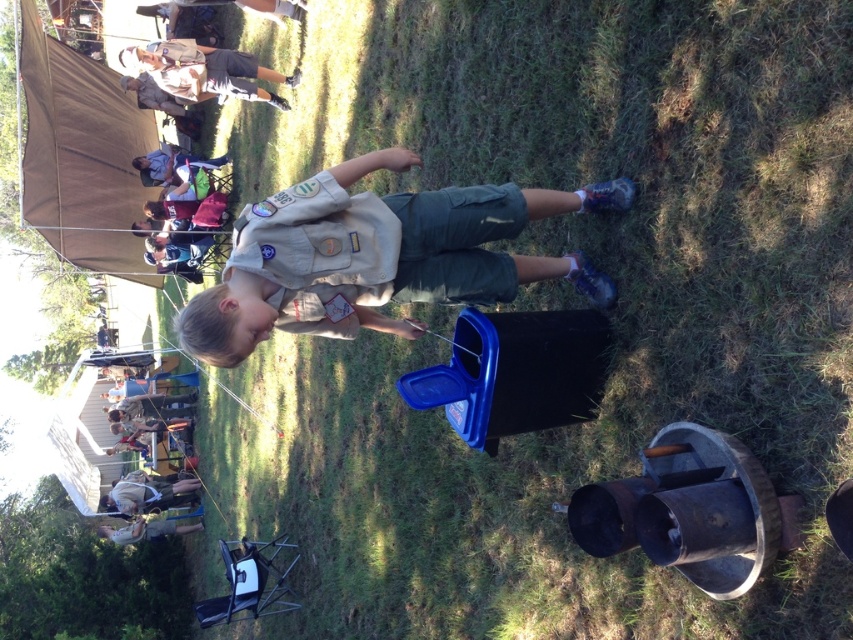
You are a photographer trying to capture a photo of the tan uniform at center and the light brown wooden chair at lower left. Since the scene is rotated, you need to adjust your camera to align with the original orientation. Which object should you focus on first to ensure the alignment?

The tan uniform at center is in front of the light brown wooden chair at lower left, so you should focus on the light brown wooden chair at lower left first to establish the background reference point for alignment.

Looking at this image, you are a photographer trying to capture a group photo of the khaki uniform at upper left and the light brown leather jacket at lower left. Since the image is rotated, you need to adjust your camera to align the horizon correctly. Which direction should you turn the image to make the horizon horizontal again?

The image was rotated 90 degrees clockwise, so you should rotate it 90 degrees counterclockwise to make the horizon horizontal again.